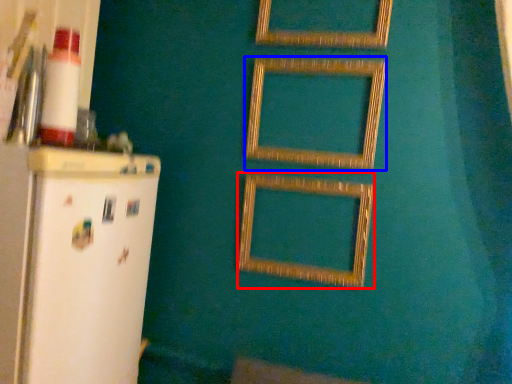
Question: Among these objects, which one is farthest to the camera, picture frame (highlighted by a red box) or picture frame (highlighted by a blue box)?

Choices:
 (A) picture frame
 (B) picture frame

Answer: (A)